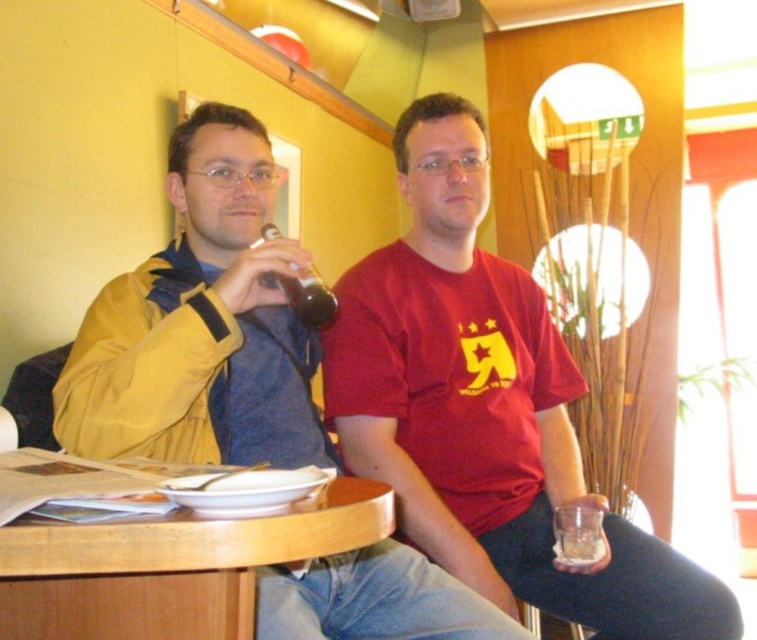
Is yellow matte jacket at left positioned behind matte glass bottle at center?

No.

Who is more distant from viewer, (223, 276) or (329, 312)?

The point (329, 312) is behind.

Is point (148, 371) positioned after point (291, 280)?

No, (148, 371) is closer to viewer.

Image resolution: width=757 pixels, height=640 pixels. I want to click on yellow matte jacket at left, so click(x=201, y=324).

Based on the photo, is red matte t-shirt at center bigger than yellow matte jacket at left?

Correct, red matte t-shirt at center is larger in size than yellow matte jacket at left.

What do you see at coordinates (484, 408) in the screenshot?
I see `red matte t-shirt at center` at bounding box center [484, 408].

Does point (511, 280) come closer to viewer compared to point (182, 308)?

No.

I want to click on red matte t-shirt at center, so click(484, 408).

Between red matte t-shirt at center and matte glass bottle at center, which one is positioned lower?

red matte t-shirt at center is below.

Can you confirm if red matte t-shirt at center is wider than matte glass bottle at center?

Indeed, red matte t-shirt at center has a greater width compared to matte glass bottle at center.

Which is in front, point (432, 232) or point (310, 269)?

Point (310, 269) is more forward.

Where is `red matte t-shirt at center`? red matte t-shirt at center is located at coordinates (484, 408).